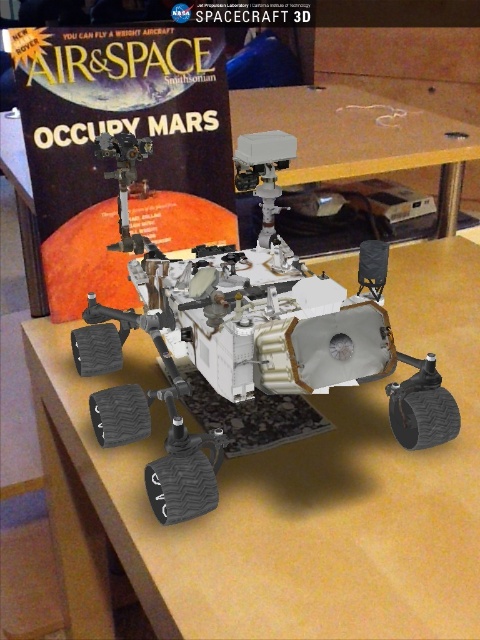
You are examining the 3D model of the Mars rover displayed on the wooden surface. You notice two points marked on the model at coordinates point [431,566] and point [334,150]. Which point is closer to your viewpoint?

Point [431,566] is closer to the camera than point [334,150].

From the picture: You are a student examining the 3D model of the Mars rover displayed on the light brown wood table at center. You need to place a small note card on the table near the rover. Given that the table is at point (x=283, y=493), where should you place the note card relative to the rover?

The light brown wood table at center is located at point (x=283, y=493). To place the note card near the rover, position it close to the rover on the table at that coordinate.

Consider the image. You are an astronaut in a VR training simulation. You see a light brown wood table at center and a wooden table at center in front of you. Which table is more to the left?

The light brown wood table at center is positioned on the left side of wooden table at center, so the light brown wood table at center is more to the left.